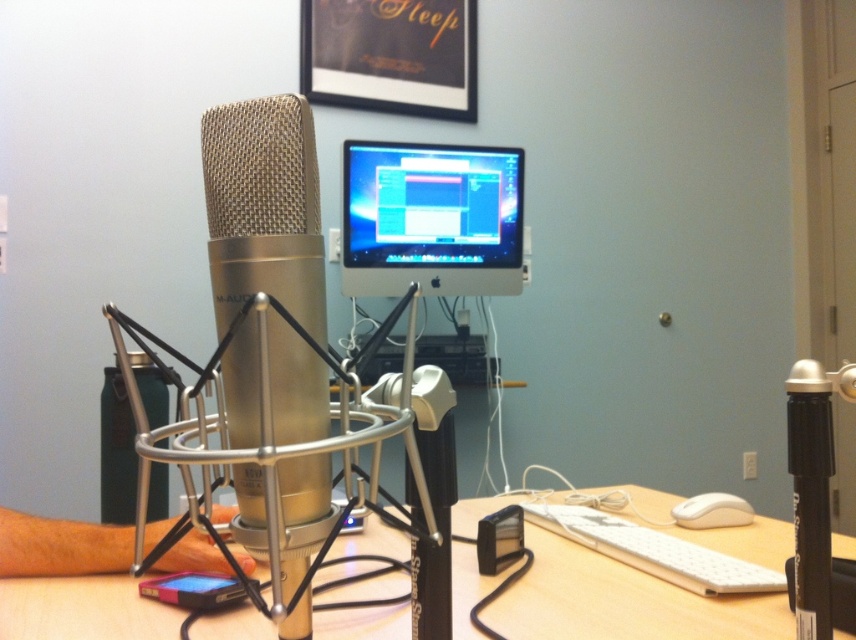
You are a technician adjusting the microphone stand in the home studio. You need to move a cable from point A at point (x=710, y=536) to point B at point (x=694, y=588). Which point is closer to you so you can reach it easily?

Point A at point (x=710, y=536) is closer to you than point B at point (x=694, y=588), so you can reach it easily.

You are setting up a new desk arrangement and want to place a decorative item between the matte black monitor at center and the white plastic keyboard at lower center. Considering their widths, which object should be placed on the left to ensure the decorative item fits snugly between them?

The matte black monitor at center is wider than the white plastic keyboard at lower center. To fit the decorative item snugly between them, place the wider matte black monitor at center on the left and the narrower white plastic keyboard at lower center on the right.